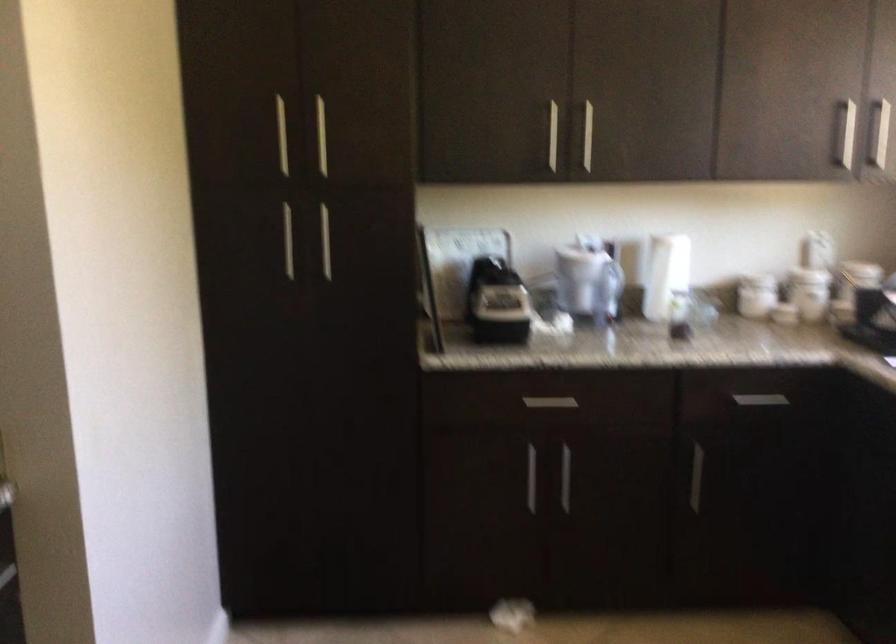
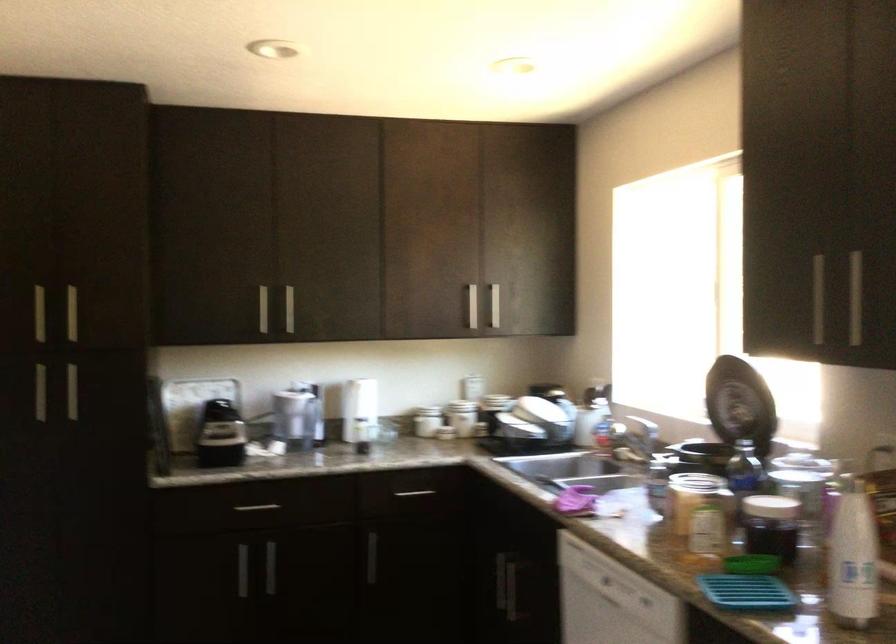
The point at (765, 295) is marked in the first image. Where is the corresponding point in the second image?

(426, 421)